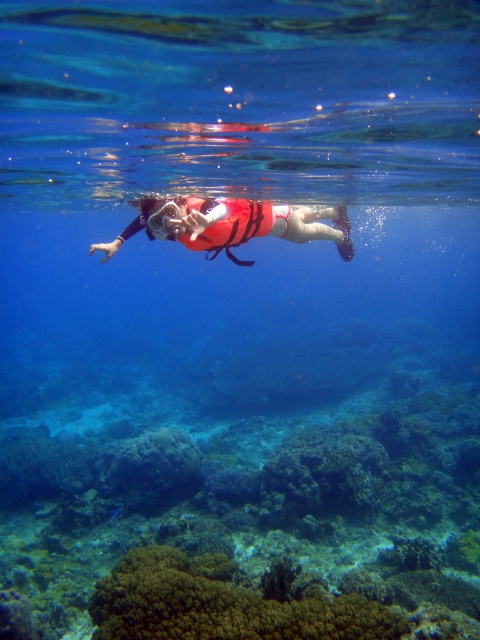
You are a snorkeler who wants to position themselves exactly at the center of the image. The green textured coral reef at center is your reference point. Based on its coordinates, can you determine if you are currently positioned to the left or right of the coral reef?

The green textured coral reef at center is located at coordinates point (250,525). Since the x coordinate is 0.823, which is greater than 0.5, you are positioned to the right of the coral reef.

You are a snorkeler who wants to explore the coral reef. The coordinates of the green textured coral reef at center are given as point (250, 525). If you are currently at the surface, which direction should you swim to reach the green textured coral reef at center?

The point (250, 525) marks the green textured coral reef at center, so you should swim downward from the surface to reach it.

You are a marine biologist observing the underwater scene. You need to determine which object takes up more area in the image between the brown textured coral at lower center and the red life vest at center. Which one is it?

The red life vest at center occupies more area in the image than the brown textured coral at lower center.